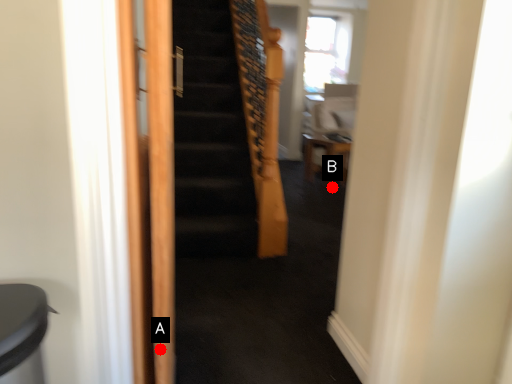
Question: Two points are circled on the image, labeled by A and B beside each circle. Which of the following is the closest to the observer?

Choices:
 (A) A is closer
 (B) B is closer

Answer: (A)